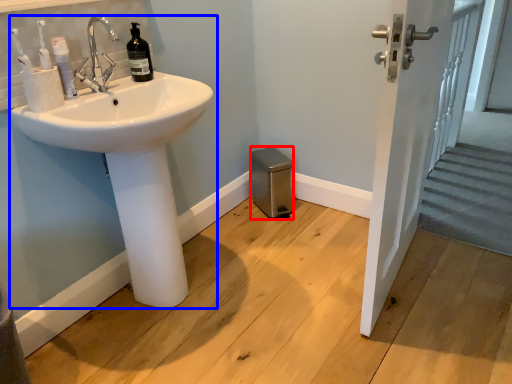
Question: Among these objects, which one is farthest to the camera, bidet (highlighted by a red box) or sink (highlighted by a blue box)?

Choices:
 (A) bidet
 (B) sink

Answer: (A)